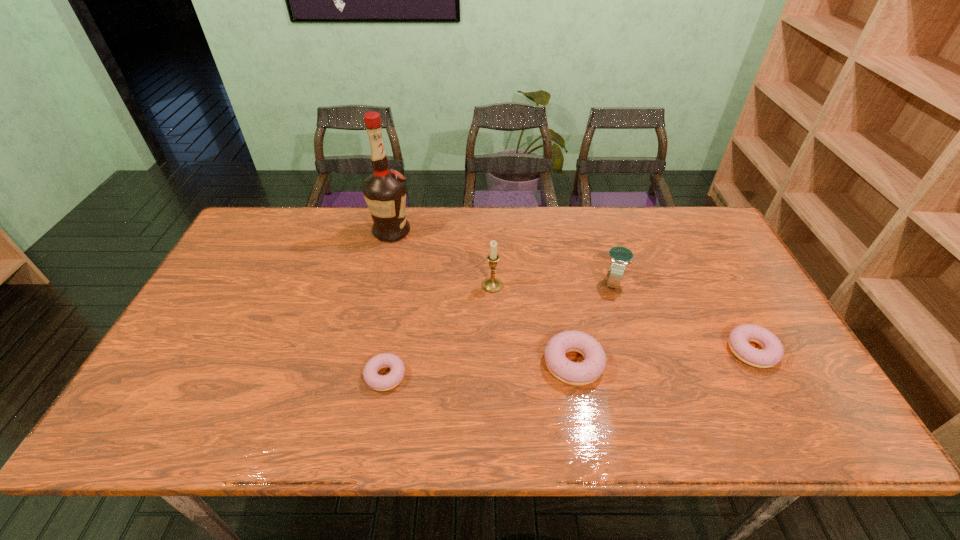
Image resolution: width=960 pixels, height=540 pixels. What are the coordinates of `watch` in the screenshot? It's located at (620, 257).

The height and width of the screenshot is (540, 960). In order to click on the third tallest object in this screenshot , I will do `click(620, 257)`.

Where is `free space located 0.090m on the back of the leftmost doughnut`? The image size is (960, 540). free space located 0.090m on the back of the leftmost doughnut is located at coordinates (394, 330).

The width and height of the screenshot is (960, 540). I want to click on vacant space located 0.160m on the back of the second doughnut from right to left, so click(x=561, y=294).

You are a GUI agent. You are given a task and a screenshot of the screen. Output one action in this format:
    pyautogui.click(x=<x>, y=<y>)
    Task: Click on the vacant space situated 0.160m on the back of the second shortest object
    
    Given the screenshot: What is the action you would take?
    pyautogui.click(x=718, y=288)

Identify the location of free region located on the front and back of the liquor. Image resolution: width=960 pixels, height=540 pixels. (474, 232).

This screenshot has height=540, width=960. What are the coordinates of `vacant area situated on the right of the third object from left to right` in the screenshot? It's located at (582, 286).

The height and width of the screenshot is (540, 960). Identify the location of vacant space located 0.230m on the front of the fourth shortest object. (639, 364).

This screenshot has width=960, height=540. In order to click on object that is at the far edge in this screenshot , I will do `click(384, 191)`.

Find the location of `object located in the right edge section of the desktop`. object located in the right edge section of the desktop is located at coordinates (772, 353).